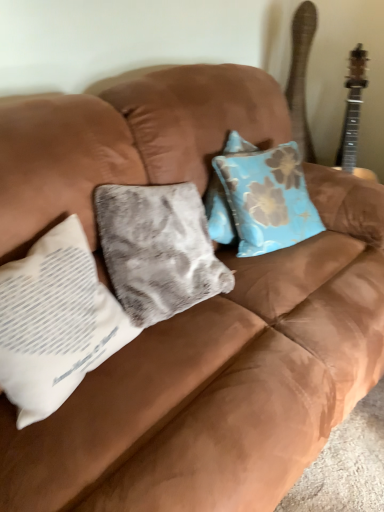
Question: Looking at the image, does wooden acoustic guitar at upper right seem bigger or smaller compared to white fabric pillow at left?

Choices:
 (A) big
 (B) small

Answer: (B)

Question: Is wooden acoustic guitar at upper right spatially inside white fabric pillow at left, or outside of it?

Choices:
 (A) outside
 (B) inside

Answer: (A)

Question: Visually, is wooden acoustic guitar at upper right positioned to the left or to the right of white fabric pillow at left?

Choices:
 (A) right
 (B) left

Answer: (A)

Question: From the image's perspective, relative to wooden acoustic guitar at upper right, is white fabric pillow at left above or below?

Choices:
 (A) above
 (B) below

Answer: (B)

Question: From a real-world perspective, is white fabric pillow at left above or below wooden acoustic guitar at upper right?

Choices:
 (A) below
 (B) above

Answer: (A)

Question: In the image, is white fabric pillow at left positioned in front of or behind wooden acoustic guitar at upper right?

Choices:
 (A) front
 (B) behind

Answer: (A)

Question: Looking at the image, does white fabric pillow at left seem bigger or smaller compared to wooden acoustic guitar at upper right?

Choices:
 (A) small
 (B) big

Answer: (B)